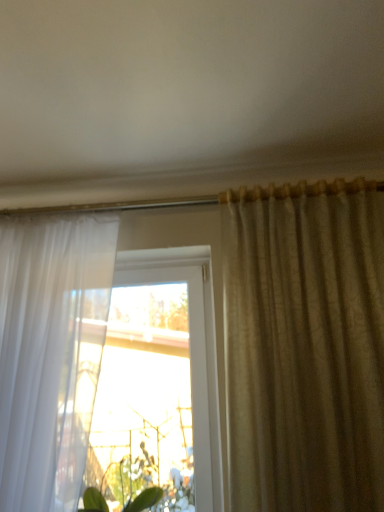
Question: Is satin beige curtain at right, acting as the second curtain starting from the left, taller than transparent glass window at center?

Choices:
 (A) yes
 (B) no

Answer: (A)

Question: Can you confirm if satin beige curtain at right, acting as the second curtain starting from the left, is wider than transparent glass window at center?

Choices:
 (A) yes
 (B) no

Answer: (A)

Question: From the image's perspective, would you say satin beige curtain at right, the 1th curtain positioned from the right, is positioned over transparent glass window at center?

Choices:
 (A) yes
 (B) no

Answer: (A)

Question: Does satin beige curtain at right, the 1th curtain positioned from the right, have a lesser height compared to transparent glass window at center?

Choices:
 (A) yes
 (B) no

Answer: (B)

Question: Is the depth of satin beige curtain at right, acting as the second curtain starting from the left, less than that of transparent glass window at center?

Choices:
 (A) no
 (B) yes

Answer: (B)

Question: Is satin beige curtain at right, acting as the second curtain starting from the left, looking in the opposite direction of transparent glass window at center?

Choices:
 (A) no
 (B) yes

Answer: (A)

Question: From the image's perspective, does white sheer curtain at left, which is counted as the second curtain, starting from the right, appear higher than transparent glass window at center?

Choices:
 (A) yes
 (B) no

Answer: (A)

Question: Does white sheer curtain at left, which is counted as the second curtain, starting from the right, have a greater width compared to transparent glass window at center?

Choices:
 (A) yes
 (B) no

Answer: (A)

Question: Is white sheer curtain at left, which is counted as the second curtain, starting from the right, thinner than transparent glass window at center?

Choices:
 (A) no
 (B) yes

Answer: (A)

Question: Is white sheer curtain at left, which is counted as the second curtain, starting from the right, facing towards transparent glass window at center?

Choices:
 (A) no
 (B) yes

Answer: (A)

Question: Considering the relative positions of white sheer curtain at left, the first curtain in the left-to-right sequence, and transparent glass window at center in the image provided, is white sheer curtain at left, the first curtain in the left-to-right sequence, to the left of transparent glass window at center from the viewer's perspective?

Choices:
 (A) no
 (B) yes

Answer: (B)

Question: Is the position of white sheer curtain at left, the first curtain in the left-to-right sequence, less distant than that of transparent glass window at center?

Choices:
 (A) no
 (B) yes

Answer: (B)

Question: Considering the relative sizes of green leafy plant at lower center and transparent glass window at center in the image provided, is green leafy plant at lower center thinner than transparent glass window at center?

Choices:
 (A) yes
 (B) no

Answer: (B)